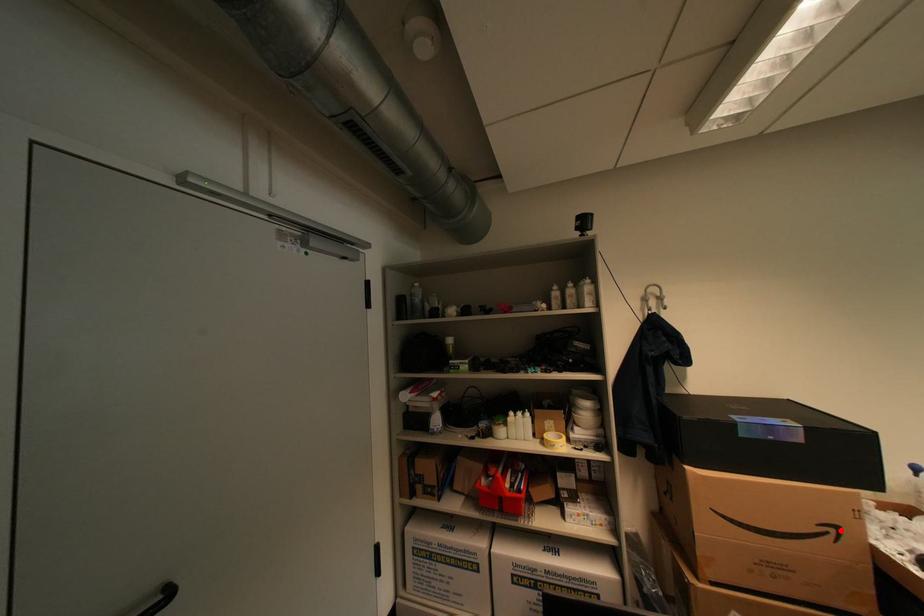
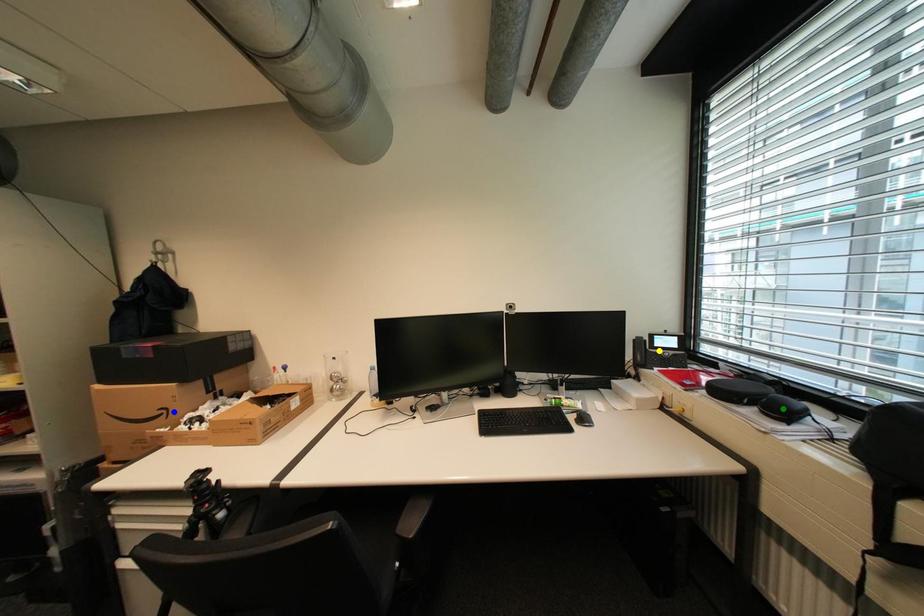
Question: I am providing you with two images of the same scene from different viewpoints. A red point is marked on the first image. You are given multiple points on the second image. In image 2, which mark is for the same physical point as the one in image 1?

Choices:
 (A) yellow point
 (B) green point
 (C) blue point

Answer: (C)